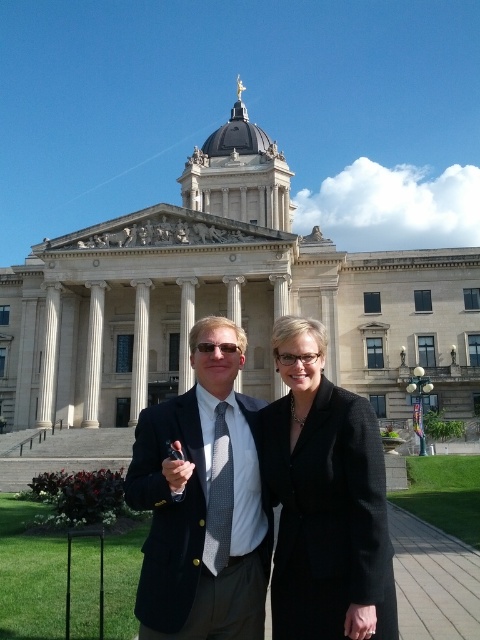
Question: Is white marble column at center in front of white marble pillar at center?

Choices:
 (A) yes
 (B) no

Answer: (B)

Question: Can you confirm if matte black blazer at center is smaller than white marble column at center?

Choices:
 (A) no
 (B) yes

Answer: (A)

Question: Which of the following is the farthest from the observer?

Choices:
 (A) (214, 433)
 (B) (139, 404)
 (C) (338, 490)
 (D) (86, 342)

Answer: (D)

Question: Does gray dotted tie at center have a larger size compared to white marble column at center?

Choices:
 (A) no
 (B) yes

Answer: (A)

Question: Which point is closer to the camera taking this photo?

Choices:
 (A) (312, 625)
 (B) (95, 284)

Answer: (A)

Question: Which point appears closest to the camera in this image?

Choices:
 (A) (145, 452)
 (B) (225, 454)
 (C) (88, 308)

Answer: (A)